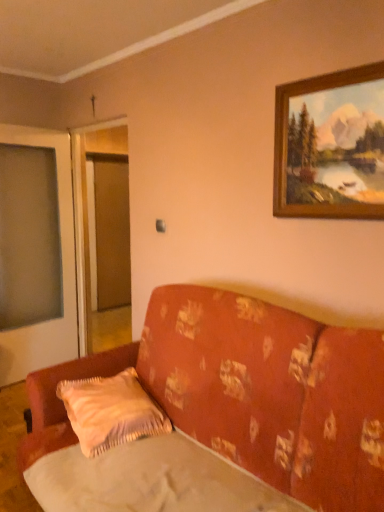
Find the location of a particular element. Image resolution: width=384 pixels, height=512 pixels. transparent glass screen door at left is located at coordinates (87, 205).

What is the approximate width of fluffy beige pillow at lower center?

17.47 inches.

Image resolution: width=384 pixels, height=512 pixels. What do you see at coordinates (142, 477) in the screenshot?
I see `silky beige sheet at lower center` at bounding box center [142, 477].

You are a GUI agent. You are given a task and a screenshot of the screen. Output one action in this format:
    pyautogui.click(x=<x>, y=<y>)
    Task: Click on the floral fabric couch at center
    
    Given the screenshot: What is the action you would take?
    pyautogui.click(x=224, y=414)

In the scene shown: Does wooden frame at upper right lie behind transparent plastic window screen at left?

No, it is not.

Between wooden frame at upper right and transparent plastic window screen at left, which one has more height?

Standing taller between the two is transparent plastic window screen at left.

From the image's perspective, is wooden frame at upper right beneath transparent plastic window screen at left?

No.

Is there a large distance between wooden frame at upper right and transparent plastic window screen at left?

Yes, wooden frame at upper right and transparent plastic window screen at left are quite far apart.

Which object is thinner, transparent plastic window screen at left or wooden frame at upper right?

With smaller width is wooden frame at upper right.

Between transparent plastic window screen at left and wooden frame at upper right, which one has more height?

With more height is transparent plastic window screen at left.

This screenshot has height=512, width=384. What are the coordinates of `window screen that appears below the wooden frame at upper right (from a real-world perspective)` in the screenshot? It's located at (29, 237).

Could you tell me if wooden frame at upper right is facing fluffy beige pillow at lower center?

No, wooden frame at upper right is not turned towards fluffy beige pillow at lower center.

Is wooden frame at upper right far away from fluffy beige pillow at lower center?

wooden frame at upper right is far away from fluffy beige pillow at lower center.

Does wooden frame at upper right contain fluffy beige pillow at lower center?

That's incorrect, fluffy beige pillow at lower center is not inside wooden frame at upper right.

Relative to transparent glass screen door at left, is wooden frame at upper right in front or behind?

Visually, wooden frame at upper right is located in front of transparent glass screen door at left.

In terms of height, does wooden frame at upper right look taller or shorter compared to transparent glass screen door at left?

In the image, wooden frame at upper right appears to be shorter than transparent glass screen door at left.

From the image's perspective, is wooden frame at upper right on transparent glass screen door at left?

Correct, wooden frame at upper right appears higher than transparent glass screen door at left in the image.

Based on their sizes in the image, would you say wooden frame at upper right is bigger or smaller than transparent glass screen door at left?

In the image, wooden frame at upper right appears to be smaller than transparent glass screen door at left.

Where is `screen door that is above the floral fabric couch at center (from a real-world perspective)`? The image size is (384, 512). screen door that is above the floral fabric couch at center (from a real-world perspective) is located at coordinates (87, 205).

How distant is transparent glass screen door at left from floral fabric couch at center?

6.71 feet.

Is transparent glass screen door at left placed right next to floral fabric couch at center?

They are not placed beside each other.

Is transparent glass screen door at left turned away from floral fabric couch at center?

That's not correct — transparent glass screen door at left is not looking away from floral fabric couch at center.

Is point (28, 294) closer or farther from the camera than point (217, 355)?

Point (28, 294) appears to be farther away from the viewer than point (217, 355).

Is transparent plastic window screen at left in contact with floral fabric couch at center?

No, transparent plastic window screen at left is not next to floral fabric couch at center.

From the image's perspective, who appears lower, transparent plastic window screen at left or floral fabric couch at center?

floral fabric couch at center, from the image's perspective.

Between transparent plastic window screen at left and floral fabric couch at center, which one appears on the left side from the viewer's perspective?

Positioned to the left is transparent plastic window screen at left.

Is floral fabric couch at center not inside silky beige sheet at lower center?

floral fabric couch at center lies outside silky beige sheet at lower center's area.

From the image's perspective, between floral fabric couch at center and silky beige sheet at lower center, which one is located above?

floral fabric couch at center appears higher in the image.

Is floral fabric couch at center far from silky beige sheet at lower center?

They are positioned close to each other.

Where is `studio couch in front of the silky beige sheet at lower center`? studio couch in front of the silky beige sheet at lower center is located at coordinates (224, 414).

Find the location of a particular element. picture frame on the right of transparent plastic window screen at left is located at coordinates (330, 145).

Where is `picture frame above the transparent plastic window screen at left (from a real-world perspective)`? The width and height of the screenshot is (384, 512). picture frame above the transparent plastic window screen at left (from a real-world perspective) is located at coordinates (330, 145).

When comparing their distances from transparent glass screen door at left, does wooden frame at upper right or silky beige sheet at lower center seem further?

silky beige sheet at lower center is further to transparent glass screen door at left.

Looking at this image, looking at the image, which one is located closer to transparent plastic window screen at left, floral fabric couch at center or transparent glass screen door at left?

transparent glass screen door at left lies closer to transparent plastic window screen at left than the other object.

Based on their spatial positions, is floral fabric couch at center or silky beige sheet at lower center further from fluffy beige pillow at lower center?

Among the two, floral fabric couch at center is located further to fluffy beige pillow at lower center.

Which object lies nearer to the anchor point transparent plastic window screen at left, floral fabric couch at center or silky beige sheet at lower center?

floral fabric couch at center.

Looking at the image, which one is located closer to transparent glass screen door at left, wooden frame at upper right or floral fabric couch at center?

wooden frame at upper right.

Based on their spatial positions, is fluffy beige pillow at lower center or floral fabric couch at center further from silky beige sheet at lower center?

fluffy beige pillow at lower center lies further to silky beige sheet at lower center than the other object.

Looking at the image, which one is located closer to fluffy beige pillow at lower center, floral fabric couch at center or transparent plastic window screen at left?

floral fabric couch at center is positioned closer to the anchor fluffy beige pillow at lower center.

Which object lies further to the anchor point floral fabric couch at center, silky beige sheet at lower center or fluffy beige pillow at lower center?

The object further to floral fabric couch at center is fluffy beige pillow at lower center.

Find the location of a particular element. This screenshot has width=384, height=512. pillow located between silky beige sheet at lower center and transparent plastic window screen at left in the depth direction is located at coordinates pyautogui.click(x=110, y=411).

I want to click on pillow situated between transparent plastic window screen at left and wooden frame at upper right from left to right, so click(x=110, y=411).

Where is `pillow between floral fabric couch at center and transparent glass screen door at left from front to back`? The image size is (384, 512). pillow between floral fabric couch at center and transparent glass screen door at left from front to back is located at coordinates (110, 411).

Find the location of a particular element. The height and width of the screenshot is (512, 384). screen door situated between transparent plastic window screen at left and wooden frame at upper right from left to right is located at coordinates [x=87, y=205].